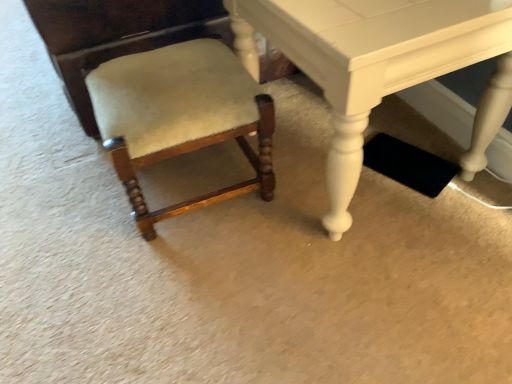
Question: From the image's perspective, is matte white table at center beneath suede-like beige chair at lower left?

Choices:
 (A) yes
 (B) no

Answer: (B)

Question: Are matte white table at center and suede-like beige chair at lower left beside each other?

Choices:
 (A) yes
 (B) no

Answer: (B)

Question: Is suede-like beige chair at lower left surrounded by matte white table at center?

Choices:
 (A) no
 (B) yes

Answer: (A)

Question: Is matte white table at center located outside suede-like beige chair at lower left?

Choices:
 (A) no
 (B) yes

Answer: (B)

Question: Does matte white table at center come behind suede-like beige chair at lower left?

Choices:
 (A) no
 (B) yes

Answer: (A)

Question: Is matte white table at center positioned with its back to suede-like beige chair at lower left?

Choices:
 (A) yes
 (B) no

Answer: (B)

Question: Is suede-like beige chair at lower left shorter than matte white table at center?

Choices:
 (A) yes
 (B) no

Answer: (A)

Question: Is suede-like beige chair at lower left further to the viewer compared to matte white table at center?

Choices:
 (A) yes
 (B) no

Answer: (A)

Question: Is suede-like beige chair at lower left turned away from matte white table at center?

Choices:
 (A) yes
 (B) no

Answer: (A)

Question: Is suede-like beige chair at lower left wider than matte white table at center?

Choices:
 (A) yes
 (B) no

Answer: (B)

Question: From a real-world perspective, is suede-like beige chair at lower left physically below matte white table at center?

Choices:
 (A) no
 (B) yes

Answer: (B)

Question: From a real-world perspective, is suede-like beige chair at lower left on top of matte white table at center?

Choices:
 (A) yes
 (B) no

Answer: (B)

Question: From the image's perspective, is matte white table at center positioned above or below suede-like beige chair at lower left?

Choices:
 (A) below
 (B) above

Answer: (B)